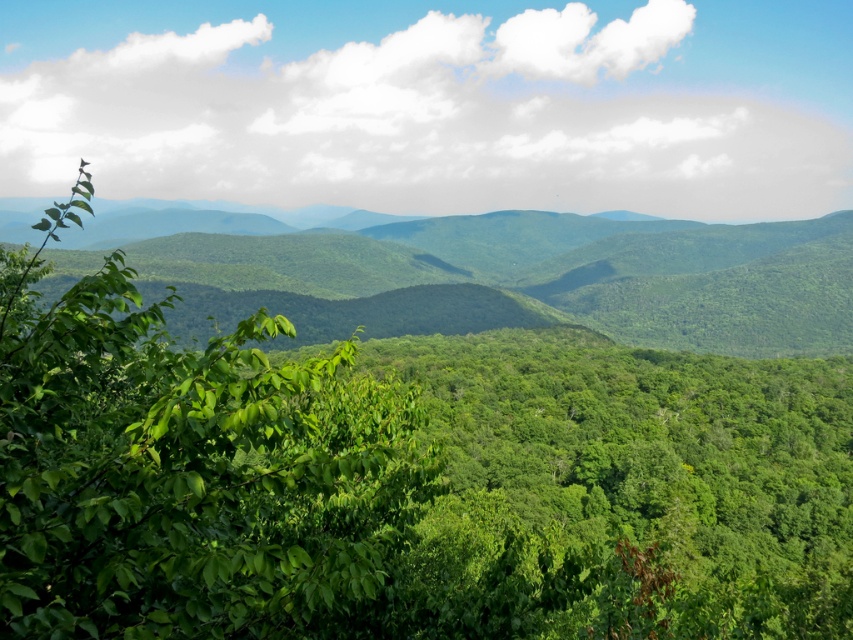
From the picture: Is green leafy tree at left to the left of green leafy forest at center from the viewer's perspective?

In fact, green leafy tree at left is to the right of green leafy forest at center.

Which is more to the left, green leafy tree at left or green leafy forest at center?

green leafy forest at center is more to the left.

Is point (311, 620) behind point (258, 236)?

No, (311, 620) is closer to viewer.

Find the location of `green leafy tree at left`. green leafy tree at left is located at coordinates (184, 467).